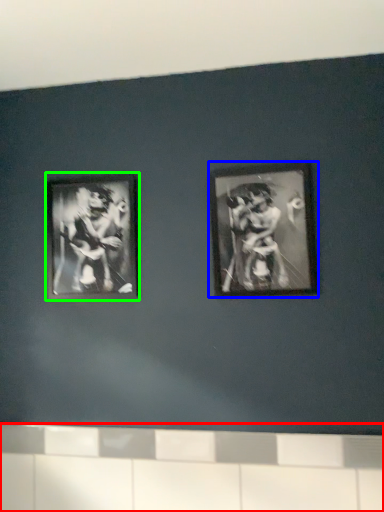
Question: Which object is positioned farthest from ledge (highlighted by a red box)? Select from picture frame (highlighted by a blue box) and picture frame (highlighted by a green box).

Choices:
 (A) picture frame
 (B) picture frame

Answer: (B)